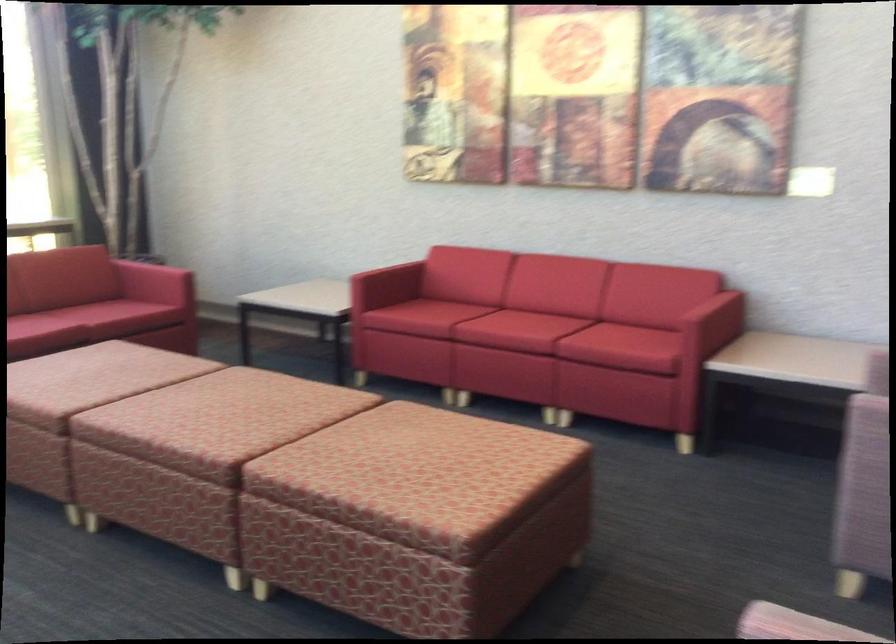
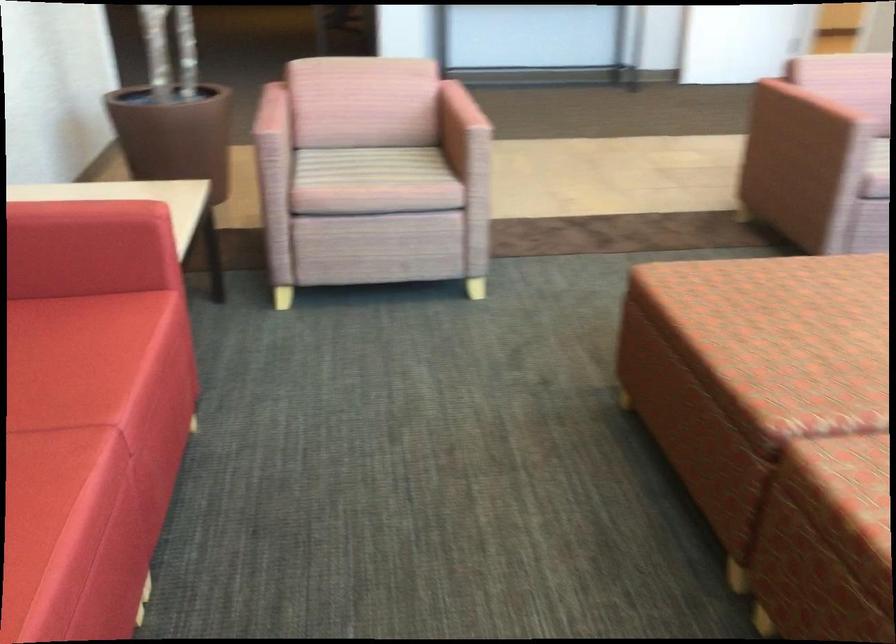
Find the pixel in the second image that matches (x=470, y=455) in the first image.

(805, 304)